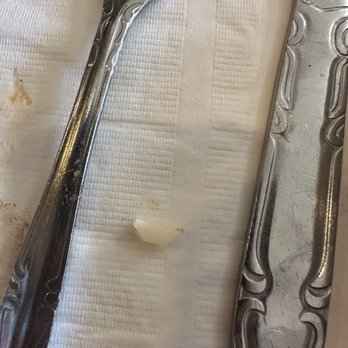
Find the location of `table`. table is located at coordinates (338, 323).